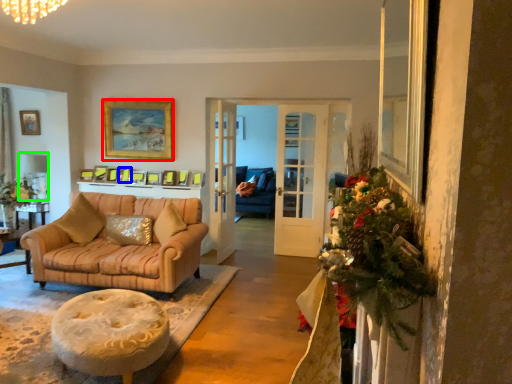
Question: Estimate the real-world distances between objects in this image. Which object is farther from picture frame (highlighted by a red box), picture frame (highlighted by a blue box) or lamp (highlighted by a green box)?

Choices:
 (A) picture frame
 (B) lamp

Answer: (B)